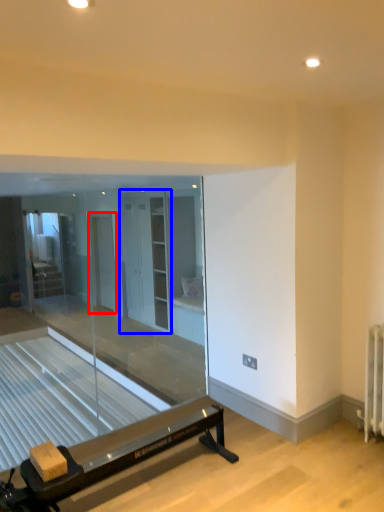
Question: Which object appears closest to the camera in this image, screen door (highlighted by a red box) or screen door (highlighted by a blue box)?

Choices:
 (A) screen door
 (B) screen door

Answer: (B)